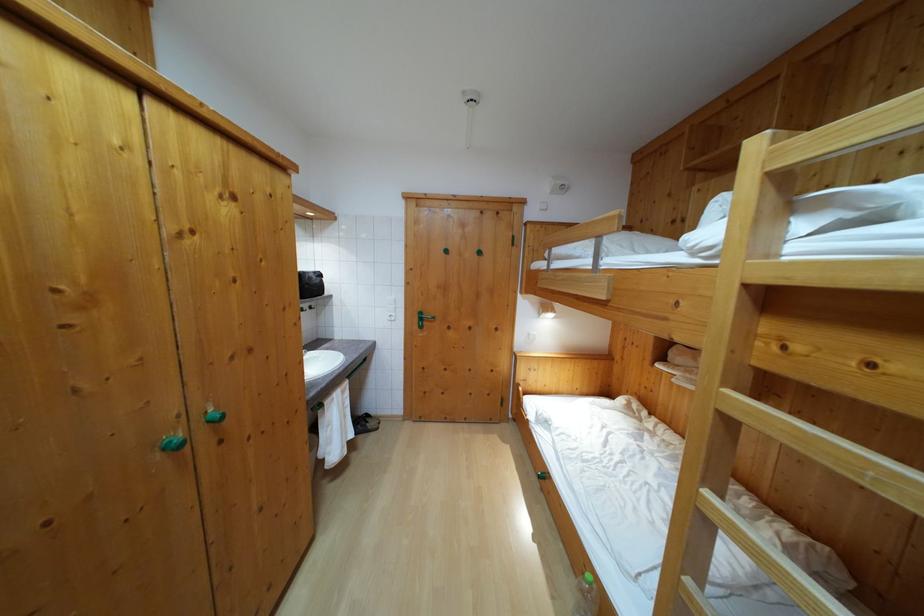
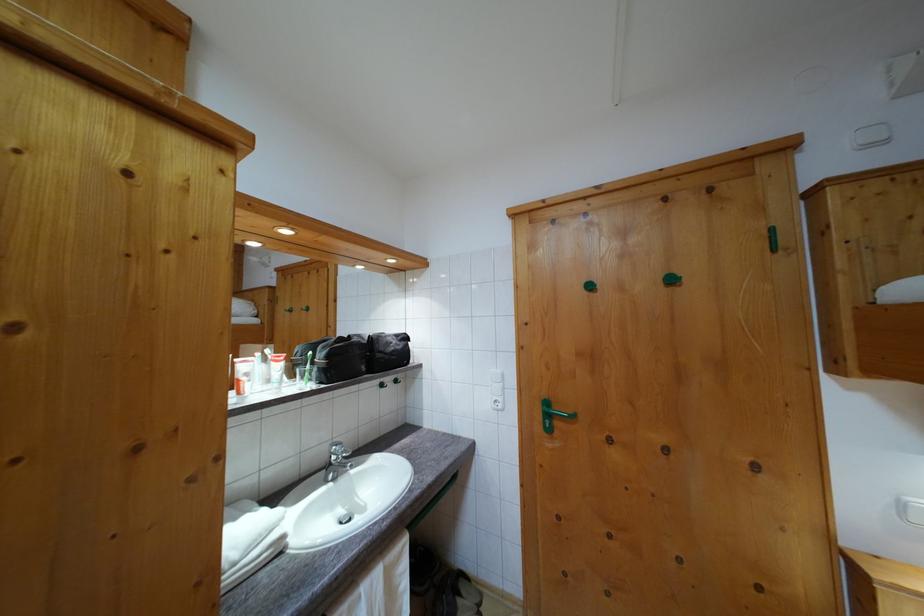
In the second image, find the point that corresponds to the point at 424,326 in the first image.

(552, 422)